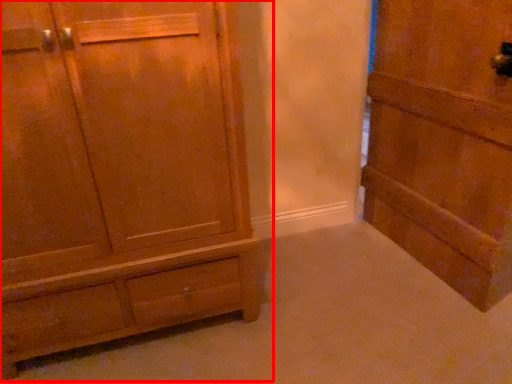
Question: From the image's perspective, where is chest of drawers (annotated by the red box) located in relation to door in the image?

Choices:
 (A) below
 (B) above

Answer: (A)